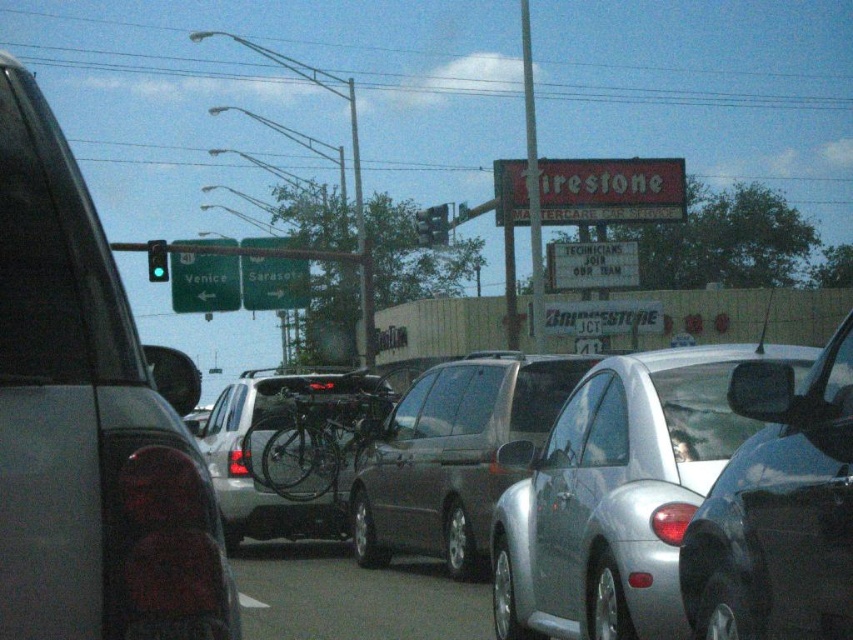
Question: Is the position of metallic silver bicycle at center more distant than that of green matte traffic light at center?

Choices:
 (A) yes
 (B) no

Answer: (B)

Question: Which point appears closest to the camera in this image?

Choices:
 (A) (584, 595)
 (B) (149, 268)
 (C) (416, 225)

Answer: (A)

Question: Can you confirm if metallic silver bicycle at center is bigger than green matte sign at upper center?

Choices:
 (A) no
 (B) yes

Answer: (A)

Question: Can you confirm if green matte street sign at upper center is positioned above green matte traffic light at center?

Choices:
 (A) no
 (B) yes

Answer: (A)

Question: Which of the following is the farthest from the observer?

Choices:
 (A) satin silver sedan at center
 (B) green glass traffic light at upper center
 (C) green matte sign at upper center
 (D) green matte traffic light at center

Answer: (C)

Question: Which object is farther from the camera taking this photo?

Choices:
 (A) green matte traffic light at center
 (B) silver metallic car at center

Answer: (A)